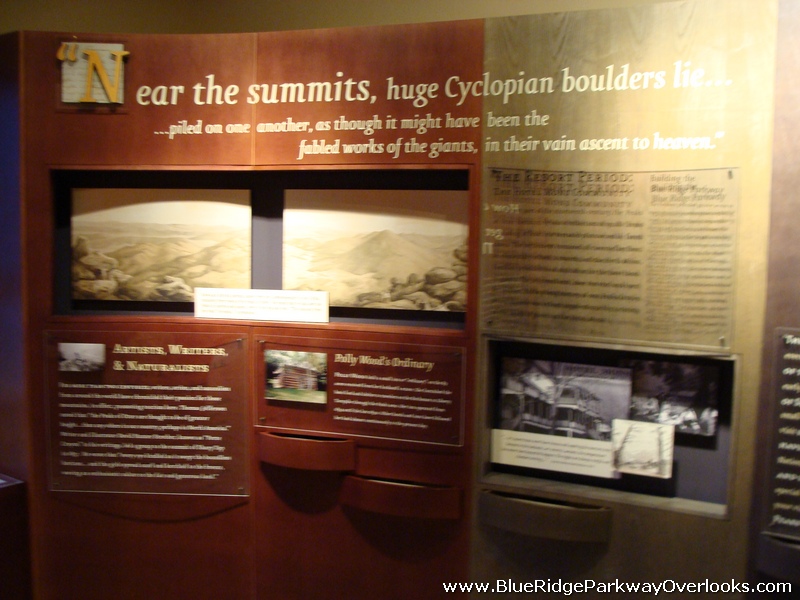
The width and height of the screenshot is (800, 600). I want to click on display on shelves little, so click(x=554, y=520), click(x=402, y=479), click(x=290, y=434).